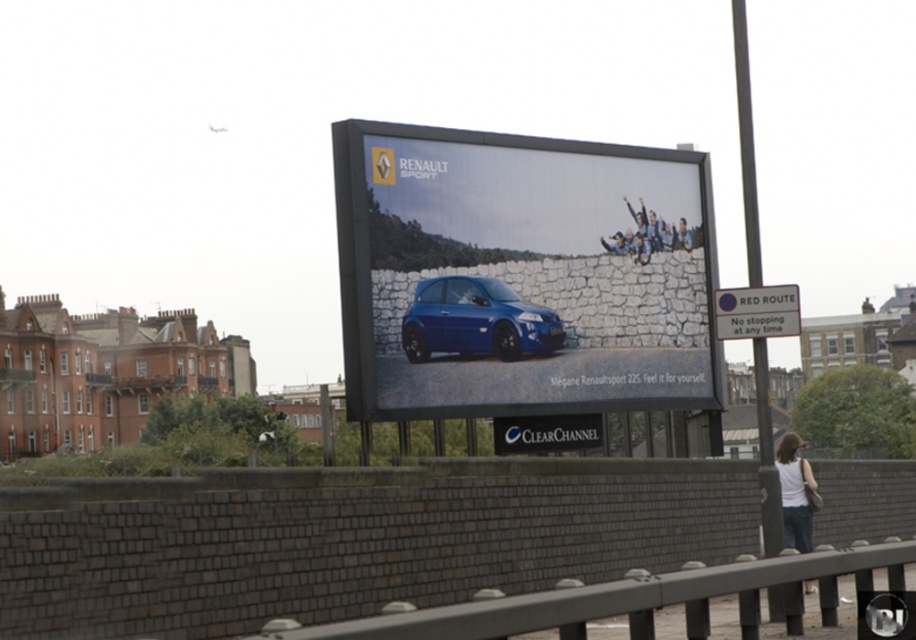
Does point (713, 388) come in front of point (791, 472)?

No, (713, 388) is behind (791, 472).

Between shiny blue car at center and white fabric shirt at lower right, which one has more height?

shiny blue car at center

Describe the element at coordinates (526, 268) in the screenshot. This screenshot has height=640, width=916. I see `shiny blue car at center` at that location.

I want to click on shiny blue car at center, so click(526, 268).

Does matte blue hatchback at center appear on the left side of white fabric shirt at lower right?

Correct, you'll find matte blue hatchback at center to the left of white fabric shirt at lower right.

Who is more distant from viewer, (429, 348) or (791, 449)?

The point (429, 348) is behind.

Is point (460, 284) more distant than point (803, 515)?

Yes, point (460, 284) is farther from viewer.

Find the location of a particular element. This screenshot has height=640, width=916. matte blue hatchback at center is located at coordinates (476, 321).

Is point (440, 314) in front of point (679, 218)?

Yes, it is.

Is point (463, 349) farther from camera compared to point (605, 250)?

No, (463, 349) is closer to viewer.

Identify the location of matte blue hatchback at center. (476, 321).